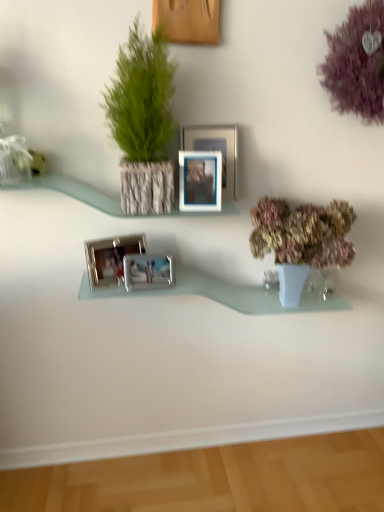
In order to click on silver metallic photo frame at center, the 1th picture frame from the bottom in this screenshot , I will do `click(148, 271)`.

Locate an element on the screen. The width and height of the screenshot is (384, 512). matte wooden shelf at upper center, which ranks as the 1th shelf in top-to-bottom order is located at coordinates coord(75,192).

Describe the element at coordinates (188, 21) in the screenshot. This screenshot has width=384, height=512. I see `wooden picture frame at upper center, which is the first picture frame in top-to-bottom order` at that location.

I want to click on silver metallic picture frame at upper center, the second picture frame positioned from the top, so click(x=216, y=150).

Where is `metallic silver picture frame at upper center, the 3th picture frame viewed from the top`? metallic silver picture frame at upper center, the 3th picture frame viewed from the top is located at coordinates (200, 181).

Is silver metallic photo frame at center, the 1th picture frame from the bottom, at the back of clear glass shelf at center, the 2th shelf viewed from the top?

No.

At what (x,y) coordinates should I click in order to perform the action: click on the 4th picture frame counting from the left side of the clear glass shelf at center, the 1th shelf from the bottom. Please return your answer as a coordinate pair (x, y). Looking at the image, I should click on click(148, 271).

From a real-world perspective, is clear glass shelf at center, the 1th shelf from the bottom, physically above silver metallic photo frame at center, the 1th picture frame from the bottom?

No, from a real-world perspective, clear glass shelf at center, the 1th shelf from the bottom, is not above silver metallic photo frame at center, the 1th picture frame from the bottom.

Between silver metallic picture frame at upper center, the fourth picture frame when ordered from bottom to top, and clear glass vase at lower right, which one is positioned in front?

silver metallic picture frame at upper center, the fourth picture frame when ordered from bottom to top, is closer to the camera.

Is silver metallic picture frame at upper center, the second picture frame positioned from the top, in contact with clear glass vase at lower right?

No.

Considering the sizes of objects silver metallic picture frame at upper center, the fourth picture frame when ordered from bottom to top, and clear glass vase at lower right in the image provided, who is smaller, silver metallic picture frame at upper center, the fourth picture frame when ordered from bottom to top, or clear glass vase at lower right?

Smaller between the two is clear glass vase at lower right.

In the scene shown: Which of these two, silver metallic picture frame at upper center, the second picture frame positioned from the top, or clear glass vase at lower right, stands shorter?

clear glass vase at lower right.

Is purple fluffy flower at upper right turned away from green textured plant at upper left, which is the first houseplant from left to right?

No.

Can you confirm if purple fluffy flower at upper right is bigger than green textured plant at upper left, which is the first houseplant in top-to-bottom order?

Incorrect, purple fluffy flower at upper right is not larger than green textured plant at upper left, which is the first houseplant in top-to-bottom order.

Which object is more forward, purple fluffy flower at upper right or green textured plant at upper left, which is the first houseplant from left to right?

green textured plant at upper left, which is the first houseplant from left to right, is more forward.

From the image's perspective, who appears lower, purple fluffy flower at upper right or green textured plant at upper left, arranged as the second houseplant when ordered from the bottom?

green textured plant at upper left, arranged as the second houseplant when ordered from the bottom, appears lower in the image.

Which object is wider, silver metallic photo frame at center, the 1th picture frame from the bottom, or silver metallic photo frame at center, which ranks as the 4th picture frame in top-to-bottom order?

silver metallic photo frame at center, which ranks as the 4th picture frame in top-to-bottom order, is wider.

Find the location of `the 1st picture frame counting from the right side of the silver metallic photo frame at center, which ranks as the 4th picture frame in top-to-bottom order`. the 1st picture frame counting from the right side of the silver metallic photo frame at center, which ranks as the 4th picture frame in top-to-bottom order is located at coordinates (148, 271).

Which is behind, point (127, 273) or point (98, 255)?

Point (98, 255)

From the picture: From the image's perspective, between silver metallic photo frame at center, the 1th picture frame from the bottom, and silver metallic photo frame at center, which ranks as the 4th picture frame in top-to-bottom order, which one is located above?

silver metallic photo frame at center, which ranks as the 4th picture frame in top-to-bottom order, from the image's perspective.

Choose the correct answer: Is silver metallic photo frame at center, which ranks as the 2th picture frame in bottom-to-top order, inside pastel pink floral arrangement at right, the first houseplant positioned from the bottom, or outside it?

The correct answer is: outside.

From the image's perspective, is silver metallic photo frame at center, which ranks as the 2th picture frame in bottom-to-top order, above or below pastel pink floral arrangement at right, the 2th houseplant from the left?

Clearly, from the image's perspective, silver metallic photo frame at center, which ranks as the 2th picture frame in bottom-to-top order, is below pastel pink floral arrangement at right, the 2th houseplant from the left.

From a real-world perspective, who is located lower, silver metallic photo frame at center, which ranks as the 4th picture frame in top-to-bottom order, or pastel pink floral arrangement at right, the first houseplant positioned from the bottom?

In real-world perspective, silver metallic photo frame at center, which ranks as the 4th picture frame in top-to-bottom order, is lower.

From the image's perspective, starting from the silver metallic photo frame at center, which ranks as the 4th picture frame in top-to-bottom order, which houseplant is the 1st one above? Please provide its 2D coordinates.

[(301, 240)]

Who is bigger, matte wooden shelf at upper center, which ranks as the 1th shelf in top-to-bottom order, or clear glass shelf at center, the 1th shelf from the bottom?

clear glass shelf at center, the 1th shelf from the bottom.

From a real-world perspective, which object rests below the other?

clear glass shelf at center, the 2th shelf viewed from the top, from a real-world perspective.

You are a GUI agent. You are given a task and a screenshot of the screen. Output one action in this format:
    pyautogui.click(x=<x>, y=<y>)
    Task: Click on the shelf lying above the clear glass shelf at center, the 1th shelf from the bottom (from the image's perspective)
    The height and width of the screenshot is (512, 384).
    Given the screenshot: What is the action you would take?
    pyautogui.click(x=75, y=192)

Can you tell me how much matte wooden shelf at upper center, which ranks as the 1th shelf in top-to-bottom order, and clear glass shelf at center, the 2th shelf viewed from the top, differ in facing direction?

matte wooden shelf at upper center, which ranks as the 1th shelf in top-to-bottom order, and clear glass shelf at center, the 2th shelf viewed from the top, are facing 0.326 degrees away from each other.

Does point (159, 5) lie behind point (166, 276)?

No.

Could you tell me if wooden picture frame at upper center, which is the first picture frame in top-to-bottom order, is facing silver metallic photo frame at center, the 1th picture frame from the bottom?

No, wooden picture frame at upper center, which is the first picture frame in top-to-bottom order, is not facing towards silver metallic photo frame at center, the 1th picture frame from the bottom.

Between wooden picture frame at upper center, placed as the 5th picture frame when sorted from bottom to top, and silver metallic photo frame at center, the fifth picture frame viewed from the top, which one has more height?

wooden picture frame at upper center, placed as the 5th picture frame when sorted from bottom to top.

Which object is positioned more to the right, wooden picture frame at upper center, placed as the 5th picture frame when sorted from bottom to top, or silver metallic photo frame at center, the fifth picture frame viewed from the top?

Positioned to the right is wooden picture frame at upper center, placed as the 5th picture frame when sorted from bottom to top.

Image resolution: width=384 pixels, height=512 pixels. Find the location of `the 2nd picture frame in front of the clear glass shelf at center, the 2th shelf viewed from the top, starting your count from the anchor`. the 2nd picture frame in front of the clear glass shelf at center, the 2th shelf viewed from the top, starting your count from the anchor is located at coordinates (148, 271).

The height and width of the screenshot is (512, 384). There is a clear glass vase at lower right. Identify the location of the 4th picture frame above it (from the image's perspective). (216, 150).

From the image, which object appears to be farther from silver metallic picture frame at upper center, the second picture frame positioned from the top, metallic silver picture frame at upper center, the 3th picture frame viewed from the top, or clear glass vase at lower right?

The object further to silver metallic picture frame at upper center, the second picture frame positioned from the top, is clear glass vase at lower right.

From the image, which object appears to be farther from silver metallic photo frame at center, which ranks as the 2th picture frame in bottom-to-top order, pastel pink floral arrangement at right, the 2th houseplant from the left, or metallic silver picture frame at upper center, which is counted as the third picture frame, starting from the bottom?

pastel pink floral arrangement at right, the 2th houseplant from the left, is positioned further to the anchor silver metallic photo frame at center, which ranks as the 2th picture frame in bottom-to-top order.

Estimate the real-world distances between objects in this image. Which object is further from pastel pink floral arrangement at right, the 2th houseplant from the left, silver metallic photo frame at center, the 1th picture frame from the bottom, or clear glass shelf at center, the 1th shelf from the bottom?

Among the two, silver metallic photo frame at center, the 1th picture frame from the bottom, is located further to pastel pink floral arrangement at right, the 2th houseplant from the left.

Based on the photo, estimate the real-world distances between objects in this image. Which object is closer to clear glass vase at lower right, silver metallic photo frame at center, the 1th picture frame from the bottom, or silver metallic photo frame at center, which ranks as the 4th picture frame in top-to-bottom order?

Among the two, silver metallic photo frame at center, the 1th picture frame from the bottom, is located nearer to clear glass vase at lower right.

Looking at the image, which one is located further to green textured plant at upper left, placed as the 2th houseplant when sorted from right to left, clear glass shelf at center, the 1th shelf from the bottom, or matte wooden shelf at upper center, which ranks as the 1th shelf in top-to-bottom order?

clear glass shelf at center, the 1th shelf from the bottom, lies further to green textured plant at upper left, placed as the 2th houseplant when sorted from right to left, than the other object.

In the scene shown: Considering their positions, is green textured plant at upper left, placed as the 2th houseplant when sorted from right to left, positioned further to silver metallic picture frame at upper center, the fourth picture frame when ordered from bottom to top, than metallic silver picture frame at upper center, which is counted as the third picture frame, starting from the bottom?

green textured plant at upper left, placed as the 2th houseplant when sorted from right to left.

In the scene shown: Based on their spatial positions, is wooden picture frame at upper center, placed as the 5th picture frame when sorted from bottom to top, or purple fluffy flower at upper right closer to pastel pink floral arrangement at right, the 2th houseplant from the left?

purple fluffy flower at upper right.

Which object lies further to the anchor point clear glass shelf at center, the 2th shelf viewed from the top, silver metallic photo frame at center, which ranks as the 2th picture frame in bottom-to-top order, or purple fluffy flower at upper right?

purple fluffy flower at upper right lies further to clear glass shelf at center, the 2th shelf viewed from the top, than the other object.

Locate an element on the screen. The image size is (384, 512). picture frame between wooden picture frame at upper center, placed as the 5th picture frame when sorted from bottom to top, and metallic silver picture frame at upper center, the 3th picture frame viewed from the top, in the up-down direction is located at coordinates (216, 150).

Locate an element on the screen. This screenshot has width=384, height=512. shelf between metallic silver picture frame at upper center, which is counted as the third picture frame, starting from the bottom, and silver metallic photo frame at center, the 1th picture frame from the bottom, in the vertical direction is located at coordinates (75, 192).

You are a GUI agent. You are given a task and a screenshot of the screen. Output one action in this format:
    pyautogui.click(x=<x>, y=<y>)
    Task: Click on the picture frame situated between metallic silver picture frame at upper center, which is counted as the third picture frame, starting from the bottom, and purple fluffy flower at upper right from left to right
    This screenshot has width=384, height=512.
    Given the screenshot: What is the action you would take?
    coord(216,150)

The width and height of the screenshot is (384, 512). I want to click on shelf situated between green textured plant at upper left, arranged as the second houseplant when ordered from the bottom, and clear glass vase at lower right from left to right, so click(226, 294).